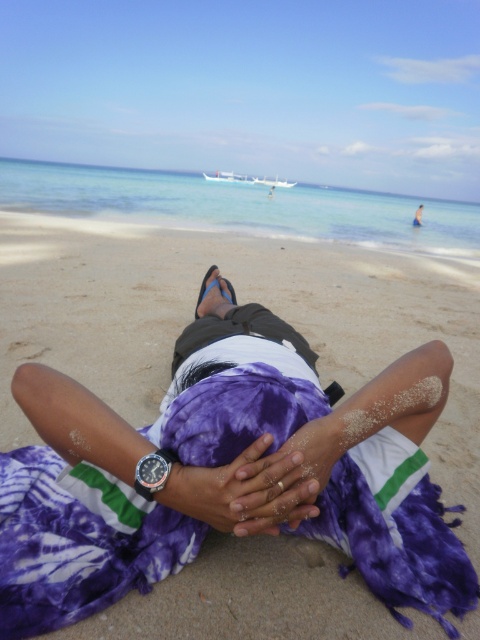
Is purple fabric at center behind purple fabric hands at center?

Yes, it is.

You are a GUI agent. You are given a task and a screenshot of the screen. Output one action in this format:
    pyautogui.click(x=<x>, y=<y>)
    Task: Click on the purple fabric at center
    This screenshot has height=640, width=480.
    Given the screenshot: What is the action you would take?
    pyautogui.click(x=239, y=301)

Which is below, purple tie-dye blanket at center or purple fabric hands at center?

Positioned lower is purple tie-dye blanket at center.

Does purple tie-dye blanket at center have a lesser height compared to purple fabric hands at center?

Incorrect, purple tie-dye blanket at center's height does not fall short of purple fabric hands at center's.

Between point (80, 525) and point (237, 493), which one is positioned in front?

Point (237, 493) is in front.

What are the coordinates of `purple tie-dye blanket at center` in the screenshot? It's located at (74, 548).

Measure the distance between purple fabric at center and purple tie-dye blanket at center.

12.52 inches

From the picture: Who is shorter, purple fabric at center or purple tie-dye blanket at center?

Standing shorter between the two is purple fabric at center.

What do you see at coordinates (239, 301) in the screenshot? I see `purple fabric at center` at bounding box center [239, 301].

In order to click on purple fabric at center in this screenshot , I will do `click(239, 301)`.